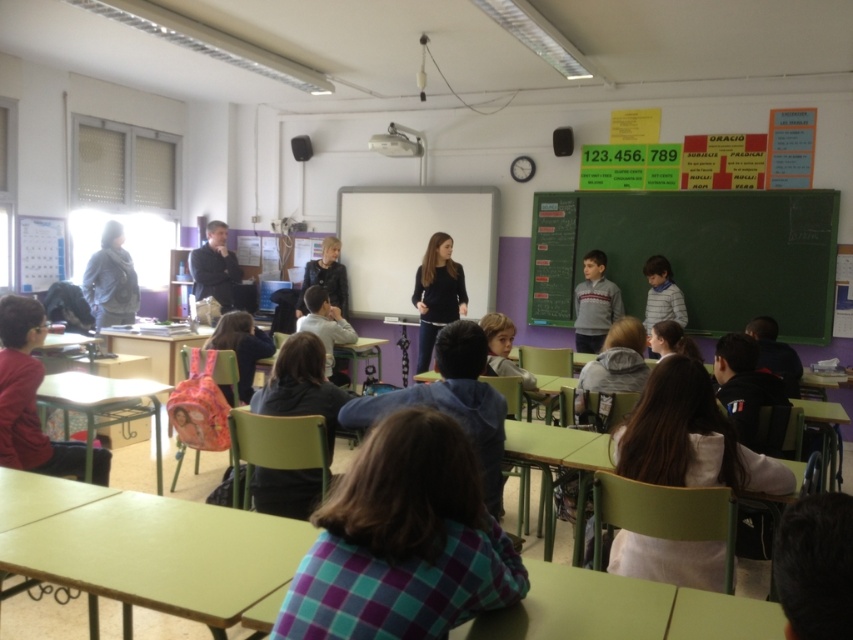
Question: Is matte plastic table at lower left to the left of dark blue suit at center from the viewer's perspective?

Choices:
 (A) yes
 (B) no

Answer: (B)

Question: Which point is farther to the camera?

Choices:
 (A) black matte shirt at center
 (B) white fabric at center
 (C) matte plastic table at lower left

Answer: (A)

Question: Among these objects, which one is nearest to the camera?

Choices:
 (A) matte plastic table at lower left
 (B) plaid shirt at center

Answer: (B)

Question: Is black matte shirt at center smaller than striped cotton shirt at center?

Choices:
 (A) yes
 (B) no

Answer: (B)

Question: Which object is the farthest from the dark blue suit at center?

Choices:
 (A) black matte shirt at center
 (B) light brown hair at center
 (C) matte plastic backpack at center
 (D) white fabric at center

Answer: (D)

Question: Does black matte shirt at center have a smaller size compared to gray fleece sweater at center?

Choices:
 (A) yes
 (B) no

Answer: (B)